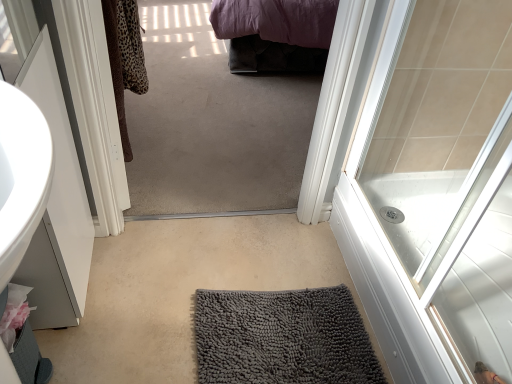
Identify the location of vacant area to the left of gray chenille bath mat at center. The height and width of the screenshot is (384, 512). (152, 303).